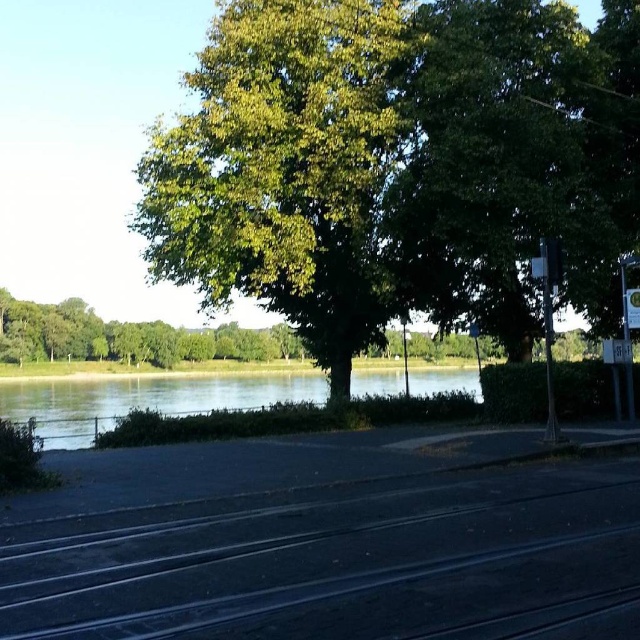
Does black asphalt train track at lower center have a lesser height compared to green water at lower left?

Yes.

Does point (513, 554) come behind point (58, 417)?

No.

Where is `black asphalt train track at lower center`? This screenshot has height=640, width=640. black asphalt train track at lower center is located at coordinates (346, 563).

In the scene shown: Who is shorter, green leafy tree at upper center or black asphalt train track at lower center?

black asphalt train track at lower center is shorter.

Does green leafy tree at upper center have a smaller size compared to black asphalt train track at lower center?

Incorrect, green leafy tree at upper center is not smaller in size than black asphalt train track at lower center.

Who is more distant from viewer, (432, 307) or (243, 595)?

The point (432, 307) is more distant.

The height and width of the screenshot is (640, 640). Find the location of `green leafy tree at upper center`. green leafy tree at upper center is located at coordinates (397, 164).

The image size is (640, 640). What do you see at coordinates (397, 164) in the screenshot?
I see `green leafy tree at upper center` at bounding box center [397, 164].

Between green leafy tree at upper center and green water at lower left, which one is positioned lower?

green water at lower left

Measure the distance between point [240,74] and camera.

Point [240,74] and camera are 71.05 feet apart from each other.

Where is `green leafy tree at upper center`? Image resolution: width=640 pixels, height=640 pixels. green leafy tree at upper center is located at coordinates (397, 164).